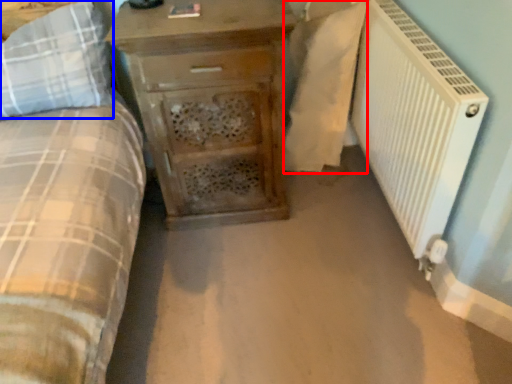
Question: Among these objects, which one is farthest to the camera, sheet (highlighted by a red box) or pillow (highlighted by a blue box)?

Choices:
 (A) sheet
 (B) pillow

Answer: (A)